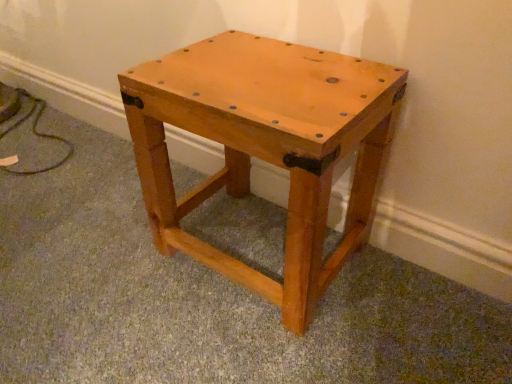
Question: Should I look upward or downward to see light brown wood stool at center?

Choices:
 (A) up
 (B) down

Answer: (A)